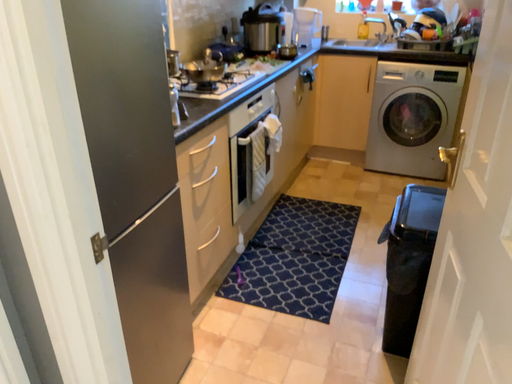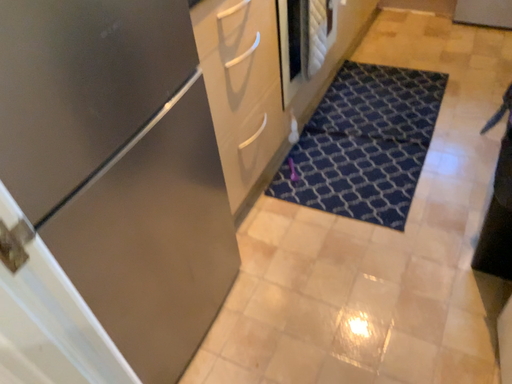
Question: How did the camera likely rotate when shooting the video?

Choices:
 (A) rotated right
 (B) rotated left

Answer: (B)